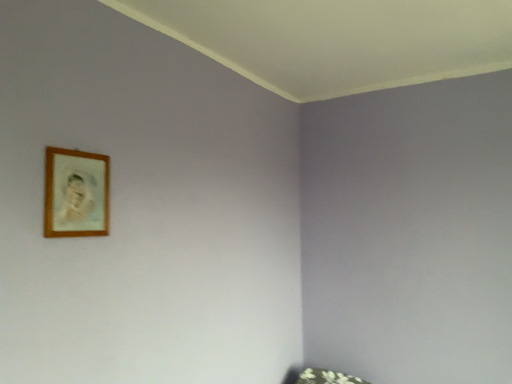
Identify the location of wooden picture frame at upper left. (76, 193).

The height and width of the screenshot is (384, 512). What do you see at coordinates (76, 193) in the screenshot?
I see `wooden picture frame at upper left` at bounding box center [76, 193].

You are a GUI agent. You are given a task and a screenshot of the screen. Output one action in this format:
    pyautogui.click(x=<x>, y=<y>)
    Task: Click on the wooden picture frame at upper left
    Image resolution: width=512 pixels, height=384 pixels.
    Given the screenshot: What is the action you would take?
    pyautogui.click(x=76, y=193)